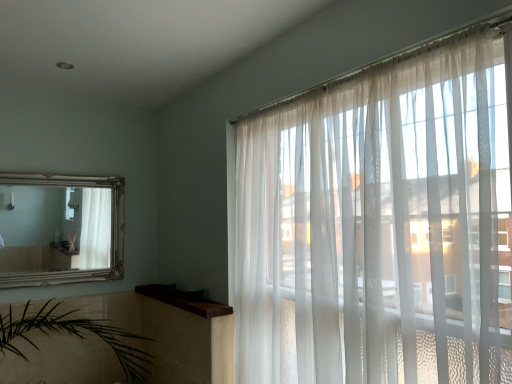
Question: From the image's perspective, is brown wood at upper left beneath silver/gilded mirror at upper left?

Choices:
 (A) yes
 (B) no

Answer: (A)

Question: Is brown wood at upper left turned away from silver/gilded mirror at upper left?

Choices:
 (A) yes
 (B) no

Answer: (B)

Question: Is brown wood at upper left in contact with silver/gilded mirror at upper left?

Choices:
 (A) no
 (B) yes

Answer: (A)

Question: From the image's perspective, is brown wood at upper left on top of silver/gilded mirror at upper left?

Choices:
 (A) yes
 (B) no

Answer: (B)

Question: Considering the relative sizes of brown wood at upper left and silver/gilded mirror at upper left in the image provided, is brown wood at upper left thinner than silver/gilded mirror at upper left?

Choices:
 (A) yes
 (B) no

Answer: (B)

Question: Can you confirm if brown wood at upper left is positioned to the left of silver/gilded mirror at upper left?

Choices:
 (A) yes
 (B) no

Answer: (B)

Question: From the image's perspective, is translucent white curtains at right over silver/gilded mirror at upper left?

Choices:
 (A) no
 (B) yes

Answer: (A)

Question: Is translucent white curtains at right facing towards silver/gilded mirror at upper left?

Choices:
 (A) yes
 (B) no

Answer: (B)

Question: Would you say silver/gilded mirror at upper left is part of translucent white curtains at right's contents?

Choices:
 (A) no
 (B) yes

Answer: (A)

Question: Does translucent white curtains at right appear on the right side of silver/gilded mirror at upper left?

Choices:
 (A) no
 (B) yes

Answer: (B)

Question: Would you say translucent white curtains at right is a long distance from silver/gilded mirror at upper left?

Choices:
 (A) yes
 (B) no

Answer: (A)

Question: From the image's perspective, is translucent white curtains at right beneath silver/gilded mirror at upper left?

Choices:
 (A) no
 (B) yes

Answer: (B)

Question: Is silver/gilded mirror at upper left facing away from brown wood at upper left?

Choices:
 (A) yes
 (B) no

Answer: (B)